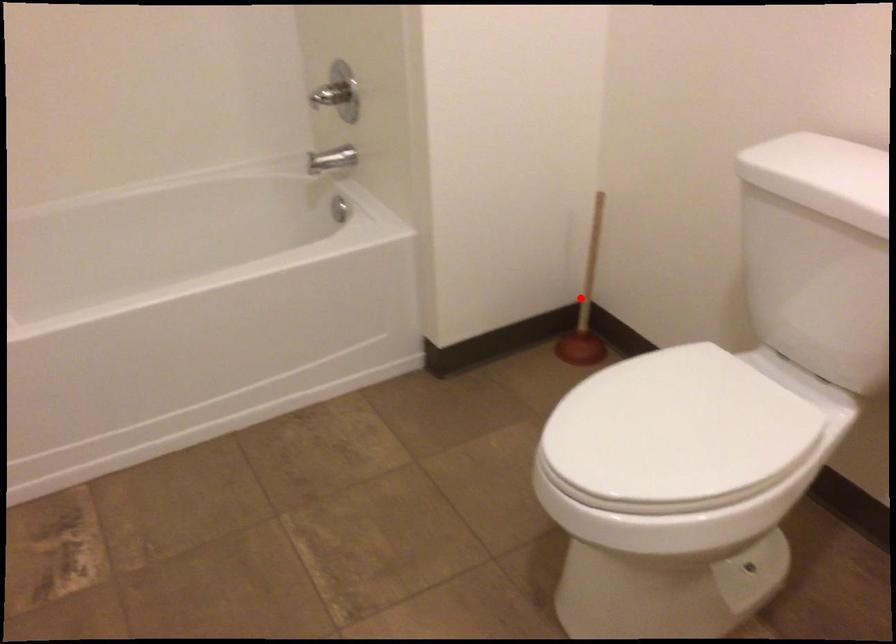
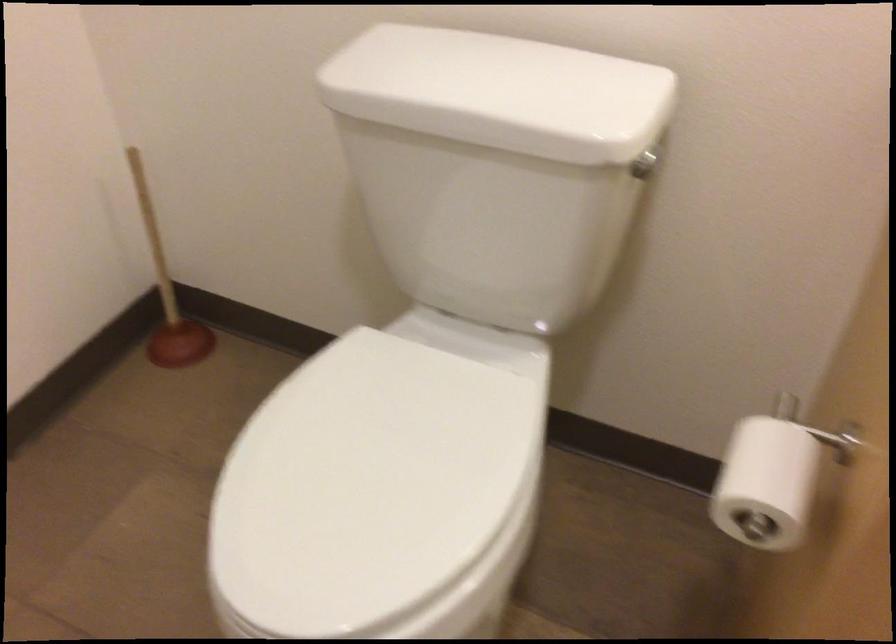
In the second image, find the point that corresponds to the highlighted location in the first image.

(167, 292)